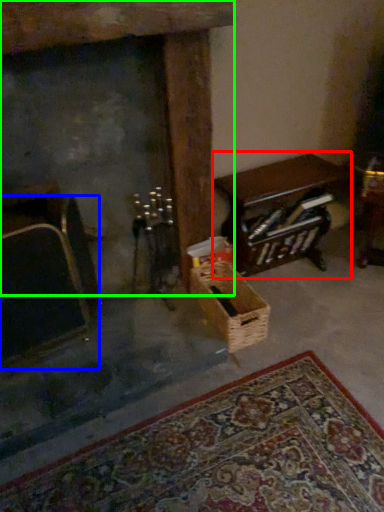
Question: Considering the real-world distances, which object is closest to table (highlighted by a red box)? armchair (highlighted by a blue box) or fireplace (highlighted by a green box).

Choices:
 (A) armchair
 (B) fireplace

Answer: (B)